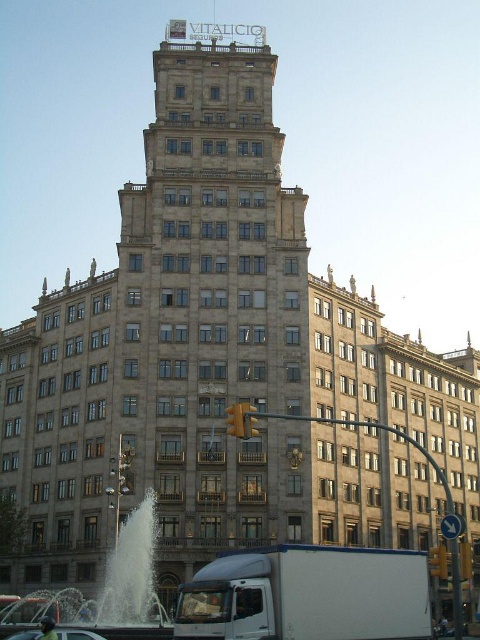
You are standing in front of the building and see the white marble fountain at lower center and the metallic silver car at lower center. Which object is closer to you?

The white marble fountain at lower center is closer to you because it is located above the metallic silver car at lower center, which places it in a higher position relative to the viewer.